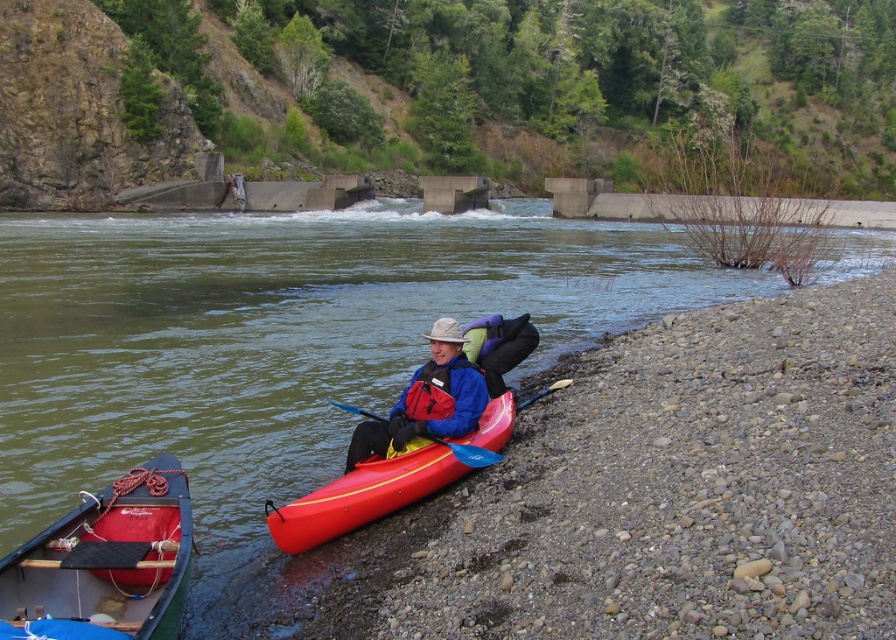
Does rubberized red canoe at lower left come in front of red nylon life jacket at lower center?

Yes, it is in front of red nylon life jacket at lower center.

Does rubberized red canoe at lower left lie behind red nylon life jacket at lower center?

No, it is not.

Locate an element on the screen. rubberized red canoe at lower left is located at coordinates (106, 563).

Is shiny plastic canoe at lower center positioned before blue plastic paddle at center?

That is True.

Does shiny plastic canoe at lower center have a lesser width compared to blue plastic paddle at center?

No.

I want to click on shiny plastic canoe at lower center, so click(x=362, y=496).

Between rubberized red canoe at lower left and blue plastic paddle at center, which one appears on the left side from the viewer's perspective?

rubberized red canoe at lower left

Can you confirm if rubberized red canoe at lower left is wider than blue plastic paddle at center?

Correct, the width of rubberized red canoe at lower left exceeds that of blue plastic paddle at center.

Locate an element on the screen. This screenshot has height=640, width=896. rubberized red canoe at lower left is located at coordinates (106, 563).